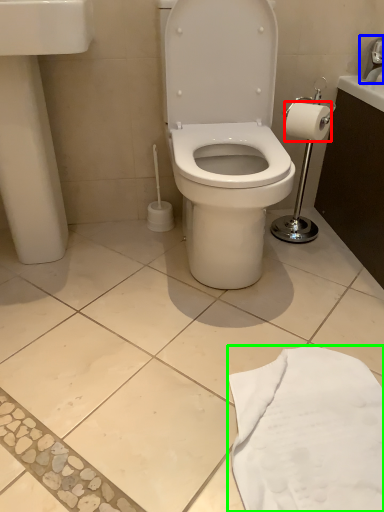
Question: Which is nearer to the toilet paper (highlighted by a red box)? faucet (highlighted by a blue box) or cloth (highlighted by a green box).

Choices:
 (A) faucet
 (B) cloth

Answer: (A)